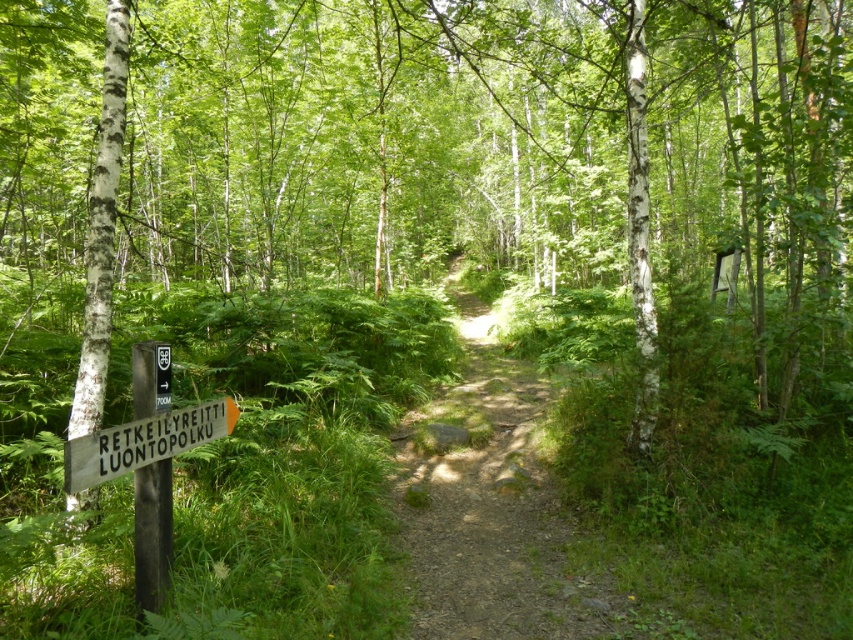
Is dirt path at center wider than white smooth birch at left?

Correct, the width of dirt path at center exceeds that of white smooth birch at left.

What do you see at coordinates (490, 504) in the screenshot? I see `dirt path at center` at bounding box center [490, 504].

Locate an element on the screen. This screenshot has width=853, height=640. dirt path at center is located at coordinates (490, 504).

Is dirt path at center shorter than wooden sign at lower left?

In fact, dirt path at center may be taller than wooden sign at lower left.

Between dirt path at center and wooden sign at lower left, which one appears on the left side from the viewer's perspective?

Positioned to the left is wooden sign at lower left.

In the scene shown: Measure the distance between dirt path at center and camera.

They are 14.44 feet apart.

Locate an element on the screen. This screenshot has height=640, width=853. dirt path at center is located at coordinates (490, 504).

Is point (102, 330) farther from viewer compared to point (206, 420)?

That is True.

Between white smooth birch at left and wooden sign at lower left, which one is positioned lower?

wooden sign at lower left

Identify the location of white smooth birch at left. (102, 227).

Locate an element on the screen. The height and width of the screenshot is (640, 853). white smooth birch at left is located at coordinates (102, 227).